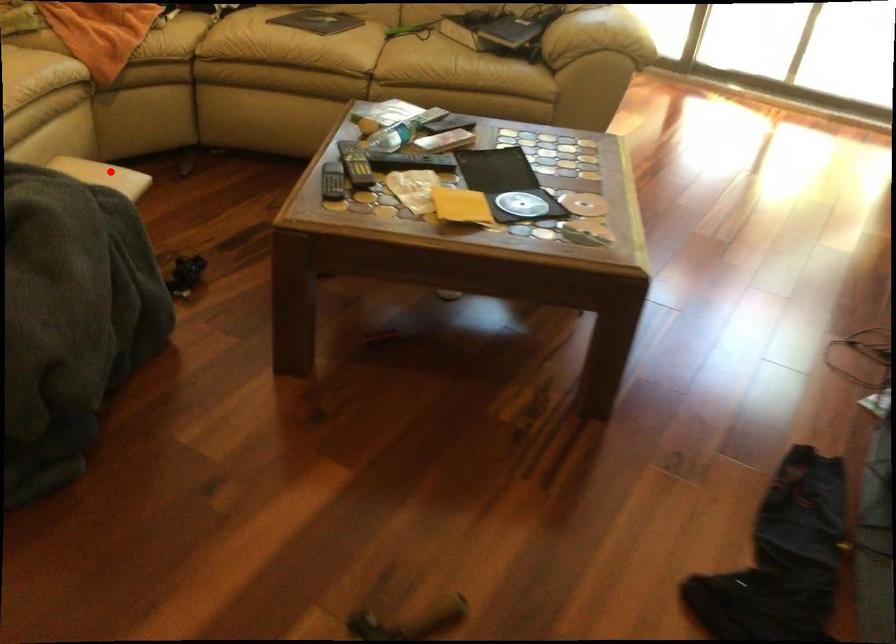
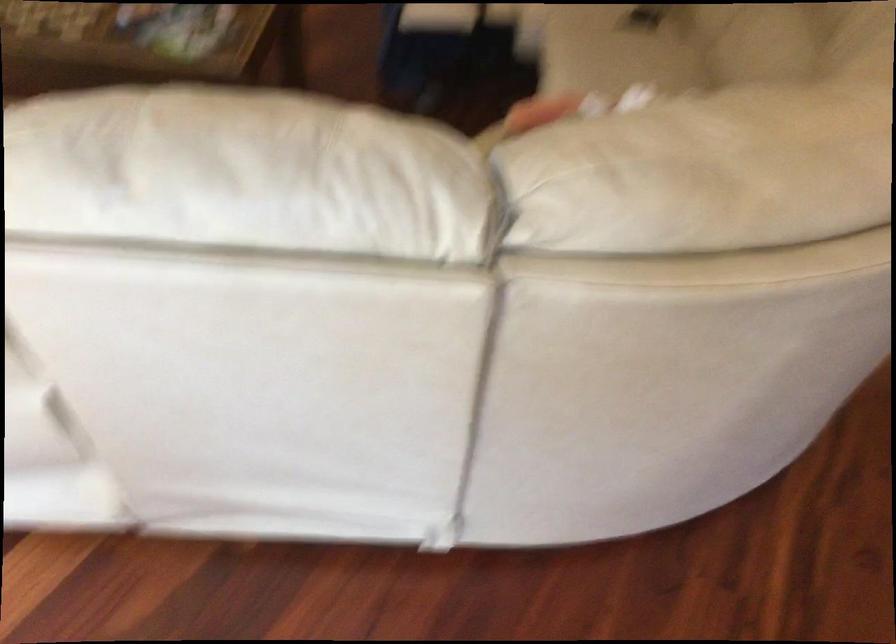
Question: I am providing you with two images of the same scene from different viewpoints. Image1 has a red point marked. In image2, the corresponding 3D location appears at what relative position? Reply with the corresponding letter.

Choices:
 (A) Closer
 (B) Farther

Answer: (B)